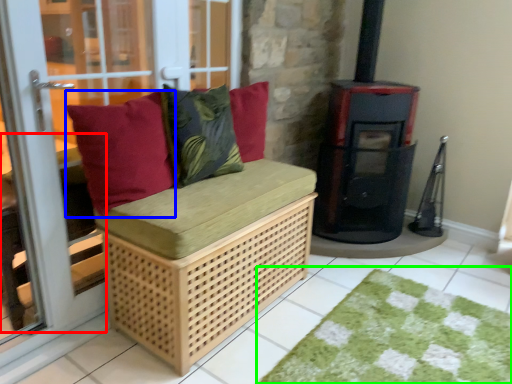
Question: Which object is positioned closest to table (highlighted by a red box)? Select from pillow (highlighted by a blue box) and doormat (highlighted by a green box).

Choices:
 (A) pillow
 (B) doormat

Answer: (A)